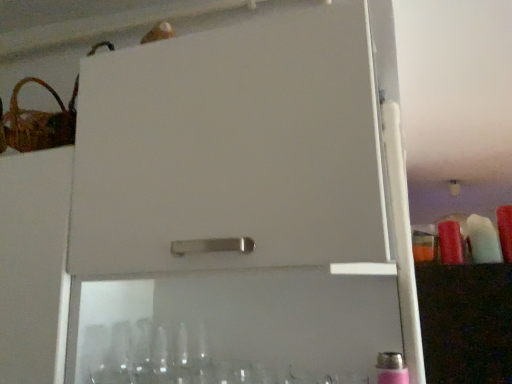
The width and height of the screenshot is (512, 384). What do you see at coordinates (37, 122) in the screenshot?
I see `woven brown basket at upper left` at bounding box center [37, 122].

What are the coordinates of `woven brown basket at upper left` in the screenshot? It's located at (37, 122).

Where is `woven brown basket at upper left`? The width and height of the screenshot is (512, 384). woven brown basket at upper left is located at coordinates (37, 122).